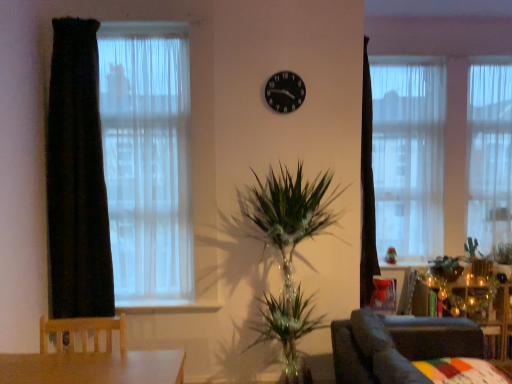
Where is `vacant area on top of white sheer curtain at upper right, the second curtain from the right (from a real-world perspective)`? vacant area on top of white sheer curtain at upper right, the second curtain from the right (from a real-world perspective) is located at coordinates (403, 56).